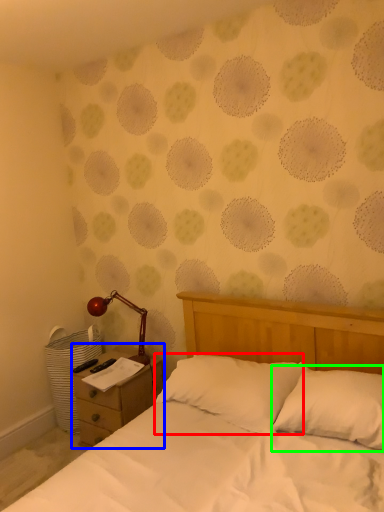
Question: Based on their relative distances, which object is nearer to pillow (highlighted by a red box)? Choose from nightstand (highlighted by a blue box) and pillow (highlighted by a green box).

Choices:
 (A) nightstand
 (B) pillow

Answer: (B)